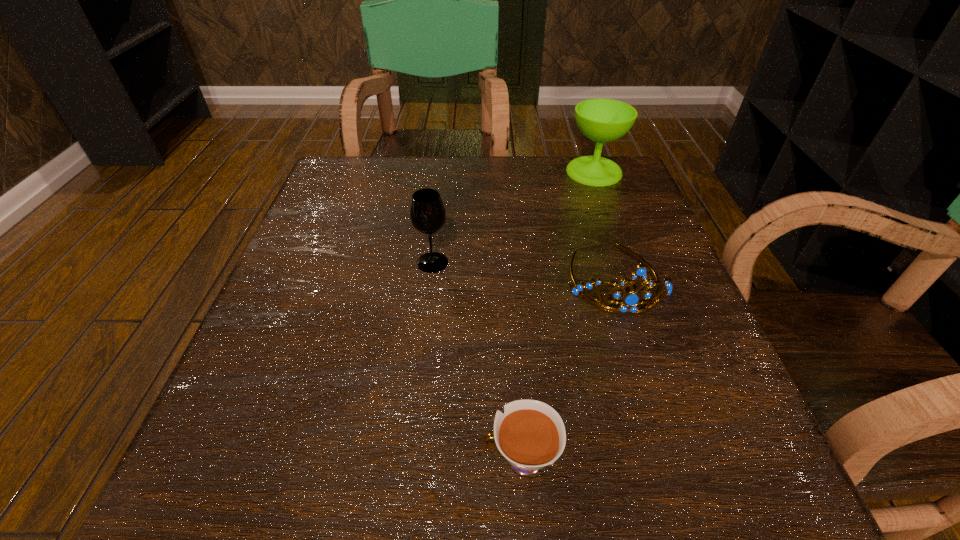
The height and width of the screenshot is (540, 960). I want to click on free point at the left edge, so click(273, 401).

In the image, there is a desktop. In order to click on vacant area at the right edge in this screenshot , I will do `click(583, 242)`.

You are a GUI agent. You are given a task and a screenshot of the screen. Output one action in this format:
    pyautogui.click(x=<x>, y=<y>)
    Task: Click on the vacant space at the far left corner of the desktop
    
    Given the screenshot: What is the action you would take?
    pyautogui.click(x=344, y=200)

This screenshot has height=540, width=960. I want to click on vacant area at the near left corner of the desktop, so click(277, 470).

This screenshot has height=540, width=960. I want to click on vacant space at the far right corner of the desktop, so click(628, 174).

What are the coordinates of `blank space at the near right corner of the desktop` in the screenshot? It's located at (687, 494).

Locate an element on the screen. The height and width of the screenshot is (540, 960). vacant point located between the farthest object and the leftmost object is located at coordinates (514, 217).

Find the location of a particular element. Image resolution: width=960 pixels, height=540 pixels. free space between the nearer wineglass and the tiara is located at coordinates (524, 271).

Locate an element on the screen. This screenshot has width=960, height=540. vacant region between the nearer wineglass and the farther wineglass is located at coordinates (514, 217).

I want to click on vacant space in between the right wineglass and the nearest object, so click(x=558, y=315).